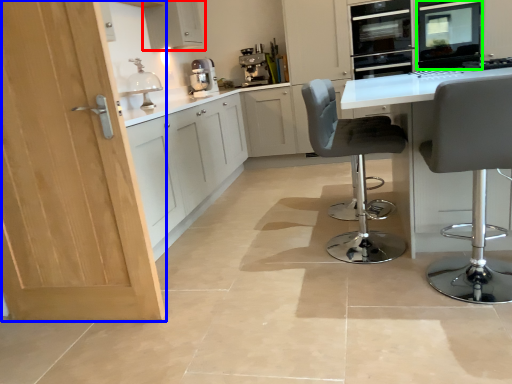
Question: Considering the real-world distances, which object is closest to cabinetry (highlighted by a red box)? door (highlighted by a blue box) or appliance (highlighted by a green box).

Choices:
 (A) door
 (B) appliance

Answer: (B)